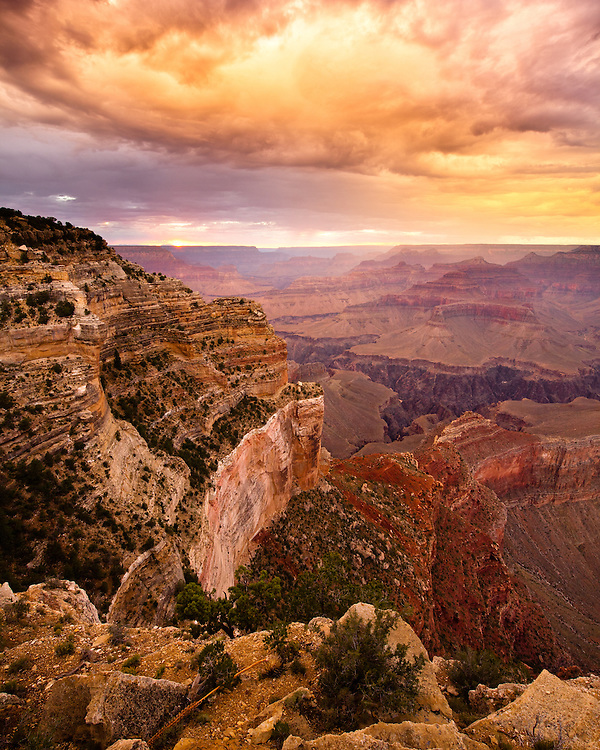
At what (x,y) coordinates should I click in order to perform the action: click on smooth looking wall. Please return your answer as a coordinate pair (x, y). Image resolution: width=600 pixels, height=750 pixels. Looking at the image, I should click on (250, 494).